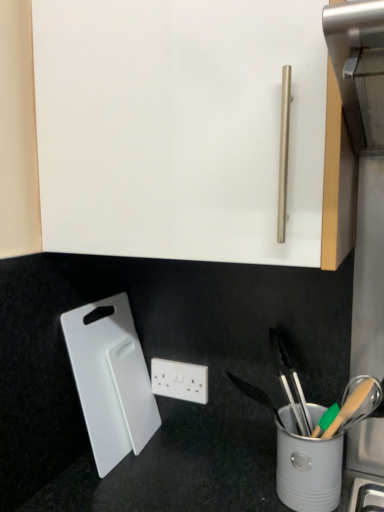
Question: From the image's perspective, is white plastic power plugs and sockets at center located above or below white plastic cutting board at lower left?

Choices:
 (A) below
 (B) above

Answer: (A)

Question: From their relative heights in the image, would you say white plastic power plugs and sockets at center is taller or shorter than white plastic cutting board at lower left?

Choices:
 (A) tall
 (B) short

Answer: (B)

Question: From a real-world perspective, is white plastic power plugs and sockets at center above or below white plastic cutting board at lower left?

Choices:
 (A) below
 (B) above

Answer: (A)

Question: Is point (94, 451) closer or farther from the camera than point (165, 389)?

Choices:
 (A) closer
 (B) farther

Answer: (A)

Question: Is white plastic cutting board at lower left taller or shorter than white plastic power plugs and sockets at center?

Choices:
 (A) short
 (B) tall

Answer: (B)

Question: Is white plastic cutting board at lower left situated inside white plastic power plugs and sockets at center or outside?

Choices:
 (A) outside
 (B) inside

Answer: (A)

Question: Is white plastic cutting board at lower left bigger or smaller than white plastic power plugs and sockets at center?

Choices:
 (A) big
 (B) small

Answer: (A)